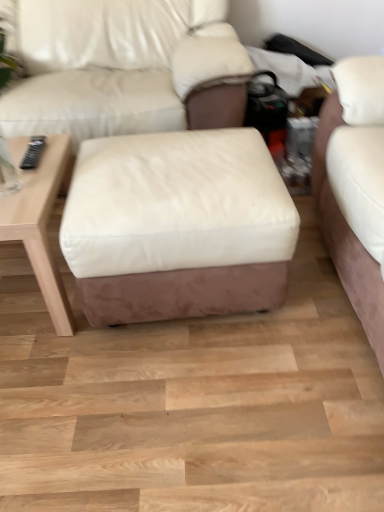
Where is `wooden table at left`? wooden table at left is located at coordinates (41, 224).

This screenshot has height=512, width=384. What do you see at coordinates (41, 224) in the screenshot? I see `wooden table at left` at bounding box center [41, 224].

The image size is (384, 512). What do you see at coordinates (178, 226) in the screenshot?
I see `white leather ottoman at center` at bounding box center [178, 226].

This screenshot has height=512, width=384. Find the location of `matte white leather couch at center`. matte white leather couch at center is located at coordinates point(126,68).

You are a GUI agent. You are given a task and a screenshot of the screen. Output one action in this format:
    pyautogui.click(x=<x>, y=<y>)
    Task: Click on the wooden table at left
    This screenshot has height=512, width=384.
    Given the screenshot: What is the action you would take?
    pyautogui.click(x=41, y=224)

Is white leather ottoman at center completely or partially inside wooden table at left?

Definitely not — white leather ottoman at center is not inside wooden table at left.

Which is behind, point (54, 178) or point (186, 245)?

The point (54, 178) is farther from the camera.

From the image's perspective, which is above, wooden table at left or white leather ottoman at center?

white leather ottoman at center appears higher in the image.

Can you confirm if wooden table at left is positioned to the left of white leather ottoman at center?

Correct, you'll find wooden table at left to the left of white leather ottoman at center.

How much distance is there between white leather ottoman at center and wooden table at left?

A distance of 29.82 centimeters exists between white leather ottoman at center and wooden table at left.

Is white leather ottoman at center not near wooden table at left?

No, white leather ottoman at center is in close proximity to wooden table at left.

From a real-world perspective, between white leather ottoman at center and wooden table at left, who is vertically higher?

white leather ottoman at center, from a real-world perspective.

Which object is positioned more to the left, white leather ottoman at center or wooden table at left?

From the viewer's perspective, wooden table at left appears more on the left side.

Considering the sizes of objects wooden table at left and matte white leather couch at center in the image provided, who is bigger, wooden table at left or matte white leather couch at center?

matte white leather couch at center is bigger.

Which is more to the left, wooden table at left or matte white leather couch at center?

From the viewer's perspective, wooden table at left appears more on the left side.

From the image's perspective, which one is positioned lower, wooden table at left or matte white leather couch at center?

wooden table at left is shown below in the image.

What's the angular difference between wooden table at left and matte white leather couch at center's facing directions?

1.38 degrees.

Which is behind, point (77, 60) or point (92, 282)?

The point (77, 60) is farther from the camera.

Who is shorter, matte white leather couch at center or white leather ottoman at center?

With less height is white leather ottoman at center.

Between matte white leather couch at center and white leather ottoman at center, which one appears on the left side from the viewer's perspective?

matte white leather couch at center is more to the left.

Is wooden table at left completely or partially inside matte white leather couch at center?

No, wooden table at left is not inside matte white leather couch at center.

How far apart are matte white leather couch at center and wooden table at left?

matte white leather couch at center and wooden table at left are 24.65 inches apart from each other.

From a real-world perspective, is matte white leather couch at center physically below wooden table at left?

No.

Is matte white leather couch at center in front of or behind wooden table at left in the image?

In the image, matte white leather couch at center appears behind wooden table at left.

From the image's perspective, is white leather ottoman at center above matte white leather couch at center?

No, from the image's perspective, white leather ottoman at center is not above matte white leather couch at center.

I want to click on studio couch behind the white leather ottoman at center, so 126,68.

Which object is wider, white leather ottoman at center or matte white leather couch at center?

matte white leather couch at center.

Is white leather ottoman at center further to camera compared to matte white leather couch at center?

No, white leather ottoman at center is in front of matte white leather couch at center.

What are the coordinates of `table behind the white leather ottoman at center` in the screenshot? It's located at (41, 224).

I want to click on stool that is above the wooden table at left (from the image's perspective), so click(x=178, y=226).

Which object lies further to the anchor point white leather ottoman at center, matte white leather couch at center or wooden table at left?

matte white leather couch at center lies further to white leather ottoman at center than the other object.

Based on their spatial positions, is white leather ottoman at center or matte white leather couch at center further from wooden table at left?

Based on the image, matte white leather couch at center appears to be further to wooden table at left.

Considering their positions, is wooden table at left positioned further to white leather ottoman at center than matte white leather couch at center?

The object further to white leather ottoman at center is matte white leather couch at center.

Which object lies further to the anchor point wooden table at left, matte white leather couch at center or white leather ottoman at center?

matte white leather couch at center is positioned further to the anchor wooden table at left.

Based on their spatial positions, is wooden table at left or white leather ottoman at center closer to matte white leather couch at center?

wooden table at left lies closer to matte white leather couch at center than the other object.

From the image, which object appears to be nearer to matte white leather couch at center, white leather ottoman at center or wooden table at left?

Based on the image, wooden table at left appears to be nearer to matte white leather couch at center.

Locate an element on the screen. Image resolution: width=384 pixels, height=512 pixels. stool that lies between matte white leather couch at center and wooden table at left from top to bottom is located at coordinates (178, 226).